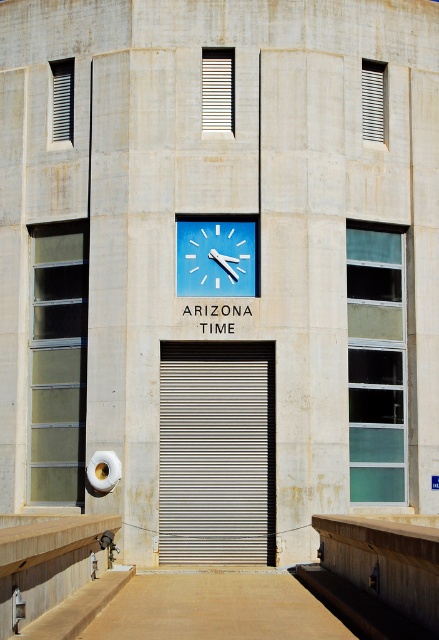
You are standing in front of the building and want to touch the point at coordinates point (200, 390). Can you reach it without any tools?

The point (200, 390) is 21.42 meters away from the viewer, so you cannot reach it without any tools.

You are a delivery person trying to load a tall package into your van. The package is 7 feet tall. You need to know if it will fit through the space between the metallic silver garage door at center and the wooden at center. Can you determine if the package will fit vertically?

The metallic silver garage door at center has a greater height compared to wooden at center. Since the package is 7 feet tall, it depends on the minimum height between the two. However, since the garage door is taller, the limiting factor would be the shorter wooden at center. If the wooden at center is shorter than 7 feet, the package won

You are an architect reviewing the building facade. You notice the wooden at center and the blue plastic clock at center. Which object is located higher on the facade?

The blue plastic clock at center is higher than wooden at center because the wooden at center is positioned under it.